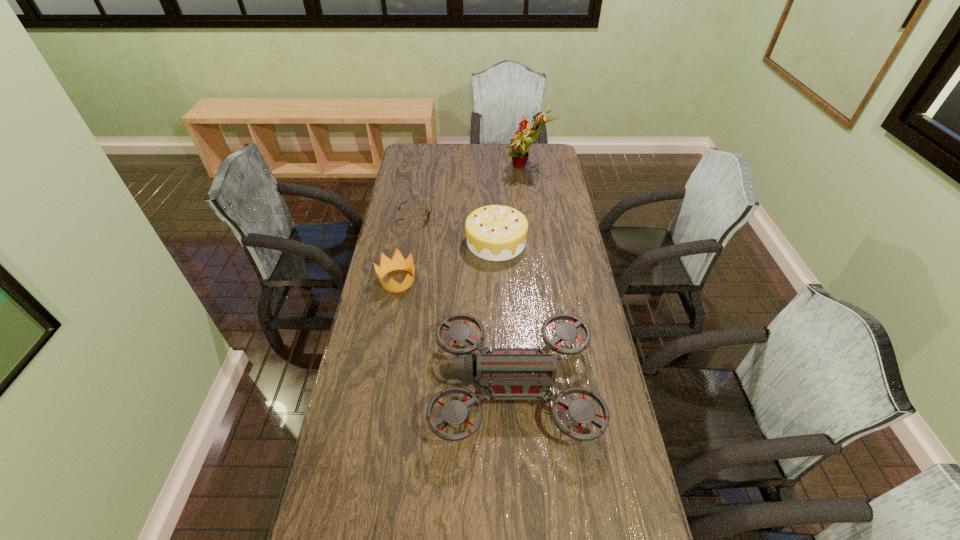
The image size is (960, 540). I want to click on drone that is at the right edge, so click(507, 373).

You are a GUI agent. You are given a task and a screenshot of the screen. Output one action in this format:
    pyautogui.click(x=<x>, y=<y>)
    Task: Click on the object that is at the far right corner
    
    Given the screenshot: What is the action you would take?
    pyautogui.click(x=519, y=144)

Where is `vacant space at the left edge of the desktop`? The image size is (960, 540). vacant space at the left edge of the desktop is located at coordinates (x=384, y=321).

In the image, there is a desktop. Where is `vacant space at the right edge`? Image resolution: width=960 pixels, height=540 pixels. vacant space at the right edge is located at coordinates (534, 176).

In the image, there is a desktop. Identify the location of vacant area at the far left corner. This screenshot has height=540, width=960. (436, 151).

I want to click on free region at the far right corner of the desktop, so click(540, 154).

I want to click on vacant area between the sunglasses and the fourth tallest object, so click(406, 248).

Where is `free spot between the birthday cake and the bouquet`? This screenshot has width=960, height=540. free spot between the birthday cake and the bouquet is located at coordinates (512, 205).

Where is `free point between the tallest object and the second shortest object`? This screenshot has width=960, height=540. free point between the tallest object and the second shortest object is located at coordinates (462, 225).

What are the coordinates of `empty space between the fourth tallest object and the farthest object` in the screenshot? It's located at (462, 225).